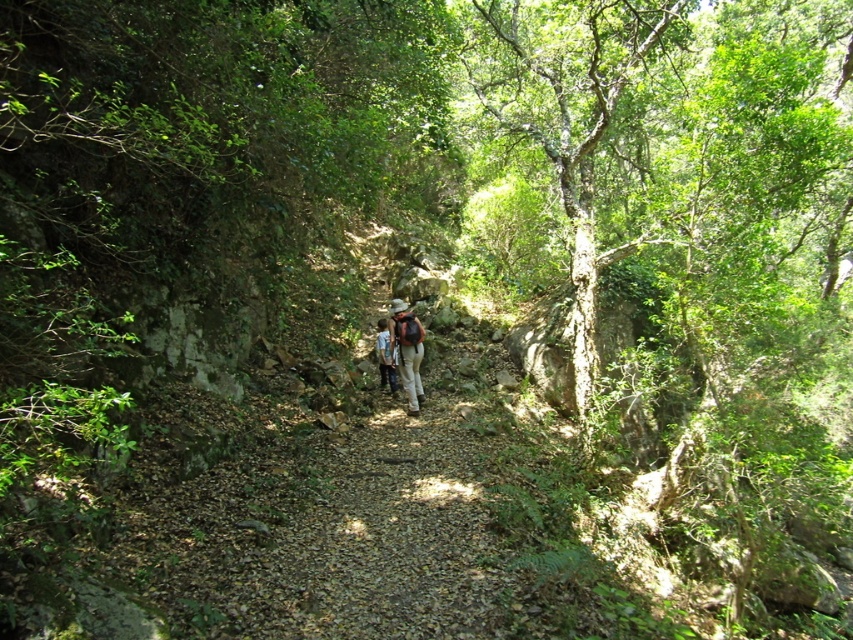
Question: In this image, where is green rough bark tree at center located relative to blue denim jeans at center?

Choices:
 (A) right
 (B) left

Answer: (A)

Question: Which of these objects is positioned farthest from the matte brown backpack at center?

Choices:
 (A) green rough bark tree at center
 (B) blue denim jeans at center

Answer: (A)

Question: Which object is farther from the camera taking this photo?

Choices:
 (A) green rough bark tree at center
 (B) matte brown backpack at center

Answer: (B)

Question: Is matte brown backpack at center to the right of blue denim jeans at center from the viewer's perspective?

Choices:
 (A) no
 (B) yes

Answer: (B)

Question: In this image, where is green rough bark tree at center located relative to matte brown backpack at center?

Choices:
 (A) left
 (B) right

Answer: (B)

Question: Based on their relative distances, which object is nearer to the matte brown backpack at center?

Choices:
 (A) blue denim jeans at center
 (B) green rough bark tree at center

Answer: (A)